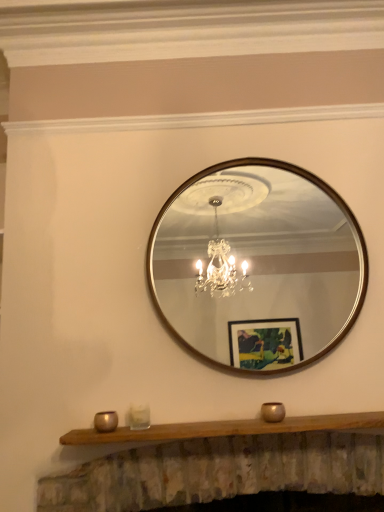
The width and height of the screenshot is (384, 512). What are the coordinates of `empty space that is ontop of wooden-framed mirror at center (from a real-world perspective)` in the screenshot? It's located at (256, 156).